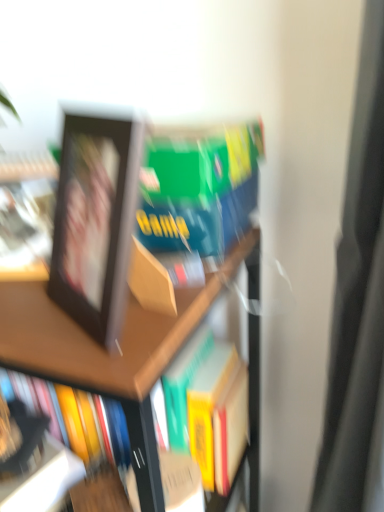
Find the location of a particular element. black matte picture frame at upper left is located at coordinates (95, 221).

In order to click on matte black photo frame at left in this screenshot , I will do `click(26, 214)`.

Locate an element on the screen. bookcase on the right of matte black photo frame at left is located at coordinates (107, 296).

Does wooden bookshelf at upper left have a greater width compared to matte black photo frame at left?

Yes, wooden bookshelf at upper left is wider than matte black photo frame at left.

From the image's perspective, is wooden bookshelf at upper left above or below matte black photo frame at left?

From the image's perspective, wooden bookshelf at upper left appears below matte black photo frame at left.

Is point (165, 221) more distant than point (103, 231)?

Yes, it is.

Are wooden bookshelf at upper left and black matte picture frame at upper left beside each other?

No, wooden bookshelf at upper left is not touching black matte picture frame at upper left.

Is wooden bookshelf at upper left inside the boundaries of black matte picture frame at upper left, or outside?

wooden bookshelf at upper left is spatially situated outside black matte picture frame at upper left.

Based on their positions, is wooden bookshelf at upper left located to the left or right of black matte picture frame at upper left?

From the image, it's evident that wooden bookshelf at upper left is to the left of black matte picture frame at upper left.

Considering the sizes of objects black matte picture frame at upper left and matte black photo frame at left in the image provided, who is shorter, black matte picture frame at upper left or matte black photo frame at left?

Standing shorter between the two is matte black photo frame at left.

From a real-world perspective, is black matte picture frame at upper left positioned over matte black photo frame at left based on gravity?

Yes, from a real-world perspective, black matte picture frame at upper left is above matte black photo frame at left.

Is matte black photo frame at left at the back of black matte picture frame at upper left?

black matte picture frame at upper left is not turned away from matte black photo frame at left.

Is there a large distance between black matte picture frame at upper left and wooden bookshelf at upper left?

black matte picture frame at upper left is near wooden bookshelf at upper left, not far away.

Based on the photo, does black matte picture frame at upper left lie behind wooden bookshelf at upper left?

No, it is not.

From a real-world perspective, is black matte picture frame at upper left physically located above or below wooden bookshelf at upper left?

From a real-world perspective, black matte picture frame at upper left is physically above wooden bookshelf at upper left.

Would you consider matte black photo frame at left to be distant from black matte picture frame at upper left?

matte black photo frame at left is actually quite close to black matte picture frame at upper left.

Based on the photo, is matte black photo frame at left facing away from black matte picture frame at upper left?

No, black matte picture frame at upper left is not at the back of matte black photo frame at left.

How different are the orientations of matte black photo frame at left and black matte picture frame at upper left in degrees?

48.2 degrees separate the facing orientations of matte black photo frame at left and black matte picture frame at upper left.

Consider the image. Is matte black photo frame at left spatially inside wooden bookshelf at upper left, or outside of it?

The correct answer is: outside.

Would you say matte black photo frame at left is a long distance from wooden bookshelf at upper left?

That's not correct — matte black photo frame at left is a little close to wooden bookshelf at upper left.

Which of these two, matte black photo frame at left or wooden bookshelf at upper left, stands shorter?

With less height is matte black photo frame at left.

Who is bigger, matte black photo frame at left or wooden bookshelf at upper left?

Bigger between the two is wooden bookshelf at upper left.

Locate an element on the screen. The height and width of the screenshot is (512, 384). bookcase on the right of matte black photo frame at left is located at coordinates (107, 296).

I want to click on picture frame lying above the wooden bookshelf at upper left (from the image's perspective), so click(95, 221).

From the image, which object appears to be nearer to matte black photo frame at left, wooden bookshelf at upper left or black matte picture frame at upper left?

black matte picture frame at upper left is positioned closer to the anchor matte black photo frame at left.

When comparing their distances from black matte picture frame at upper left, does matte black photo frame at left or wooden bookshelf at upper left seem closer?

matte black photo frame at left is closer to black matte picture frame at upper left.

Looking at the image, which one is located further to black matte picture frame at upper left, wooden bookshelf at upper left or matte black photo frame at left?

wooden bookshelf at upper left lies further to black matte picture frame at upper left than the other object.

When comparing their distances from wooden bookshelf at upper left, does matte black photo frame at left or black matte picture frame at upper left seem closer?

Based on the image, black matte picture frame at upper left appears to be nearer to wooden bookshelf at upper left.

Looking at the image, which one is located further to matte black photo frame at left, black matte picture frame at upper left or wooden bookshelf at upper left?

wooden bookshelf at upper left.

When comparing their distances from wooden bookshelf at upper left, does black matte picture frame at upper left or matte black photo frame at left seem closer?

Based on the image, black matte picture frame at upper left appears to be nearer to wooden bookshelf at upper left.

Locate an element on the screen. Image resolution: width=384 pixels, height=512 pixels. picture frame between matte black photo frame at left and wooden bookshelf at upper left in the vertical direction is located at coordinates (95, 221).